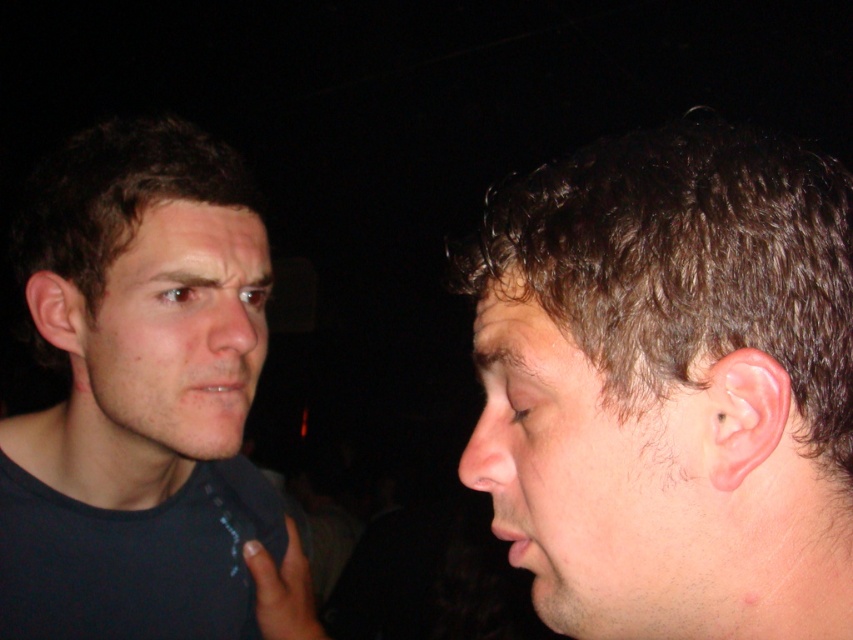
Based on the scene description, where is the pale skin at right located in terms of its 2D coordinates?

The pale skin at right is located at the 2D coordinates of point (595, 480).

You are a photographer trying to adjust the lighting for a portrait. You notice a point at coordinates [595,480] on the subject. Based on the scene description, where is this point located?

The point at coordinates [595,480] is on the pale skin at right.

Based on the photo, you are trying to locate the dark blue shirt at left in a dimly lit room. Based on the coordinates provided in the scene description, where would you expect to find it?

The dark blue shirt at left is located at point [138,394].